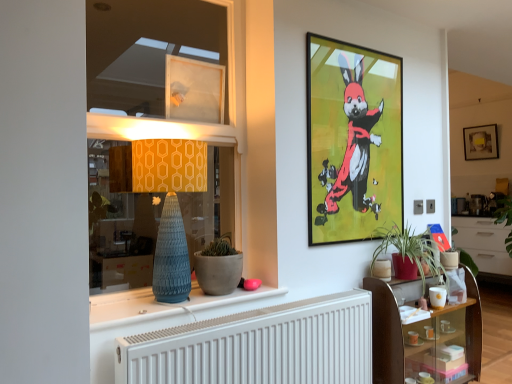
Question: From a real-world perspective, is matte blue vase at center positioned above or below matte yellow fabric at left?

Choices:
 (A) above
 (B) below

Answer: (B)

Question: Considering the positions of matte blue vase at center and matte yellow fabric at left in the image, is matte blue vase at center taller or shorter than matte yellow fabric at left?

Choices:
 (A) tall
 (B) short

Answer: (B)

Question: Estimate the real-world distances between objects in this image. Which object is closer to the white matte radiator at lower center?

Choices:
 (A) matte concrete pot at center, which appears as the 2th flowerpot when viewed from the back
 (B) matte gold picture frame at upper right, the third picture frame when ordered from front to back
 (C) metallic-framed artwork at upper center, which is the second picture frame in left-to-right order
 (D) matte yellow fabric at left
 (E) transparent plastic window at upper center, which is the 1th picture frame from left to right

Answer: (A)

Question: Which object is the closest to the transparent plastic window at upper center, which is the 1th picture frame from left to right?

Choices:
 (A) white matte flowerpot at lower right, the 2th flowerpot viewed from the left
 (B) matte concrete pot at center, acting as the 1th flowerpot starting from the left
 (C) metallic-framed artwork at upper center, positioned as the 2th picture frame in right-to-left order
 (D) wooden glass shelf at lower right
 (E) matte gold picture frame at upper right, the third picture frame positioned from the left

Answer: (C)